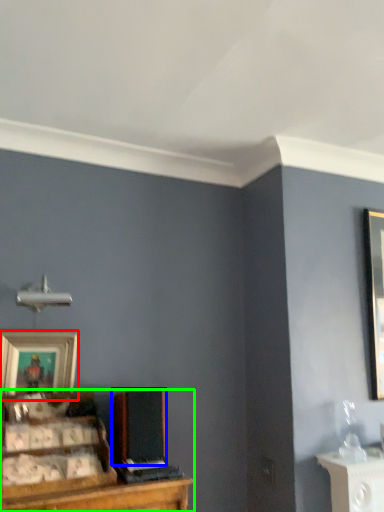
Question: Which is nearer to the picture frame (highlighted by a red box)? speaker (highlighted by a blue box) or entertainment center (highlighted by a green box).

Choices:
 (A) speaker
 (B) entertainment center

Answer: (B)